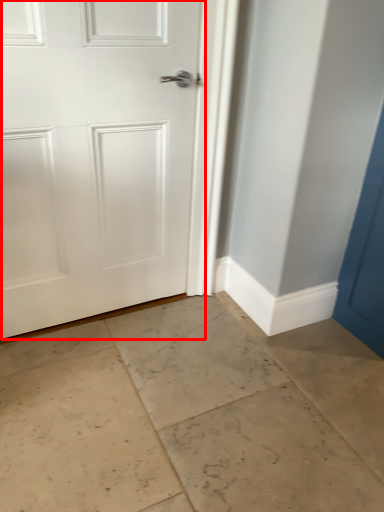
Question: From the image's perspective, where is door (annotated by the red box) located relative to concrete?

Choices:
 (A) above
 (B) below

Answer: (A)